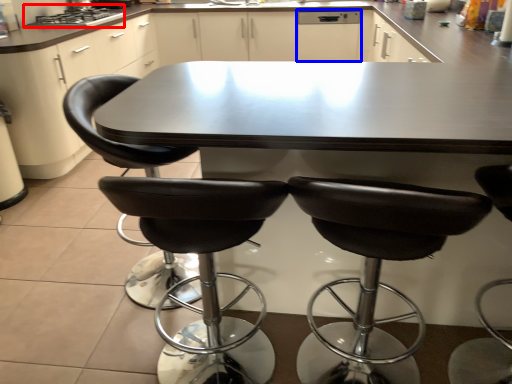
Question: Among these objects, which one is nearest to the camera, stove (highlighted by a red box) or dish washer (highlighted by a blue box)?

Choices:
 (A) stove
 (B) dish washer

Answer: (A)